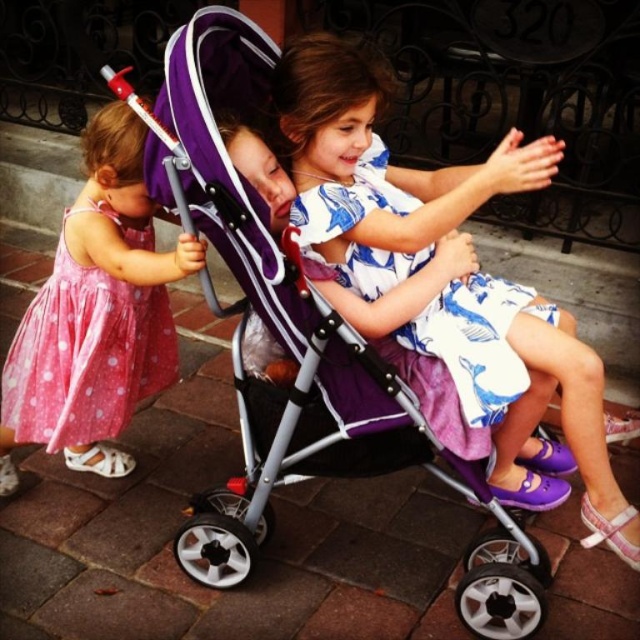
Describe the element at coordinates (378, 168) in the screenshot. Image resolution: width=640 pixels, height=640 pixels. I see `white floral dress at center` at that location.

Which is behind, point (396, 202) or point (344, 212)?

Positioned behind is point (396, 202).

Locate an element on the screen. This screenshot has width=640, height=640. white floral dress at center is located at coordinates (378, 168).

Which is below, purple fabric stroller at center or pink polka dot dress at left?

purple fabric stroller at center is below.

Is point (308, 465) more distant than point (164, 364)?

No, (308, 465) is in front of (164, 364).

You are a GUI agent. You are given a task and a screenshot of the screen. Output one action in this format:
    pyautogui.click(x=<x>, y=<y>)
    Task: Click on the purple fabric stroller at center
    
    Given the screenshot: What is the action you would take?
    click(300, 349)

From the picture: Which is more to the right, white floral dress at center or pink polka dot dress at left?

white floral dress at center is more to the right.

Between white floral dress at center and pink polka dot dress at left, which one has less height?

With less height is pink polka dot dress at left.

The height and width of the screenshot is (640, 640). Describe the element at coordinates (378, 168) in the screenshot. I see `white floral dress at center` at that location.

Locate an element on the screen. white floral dress at center is located at coordinates (378, 168).